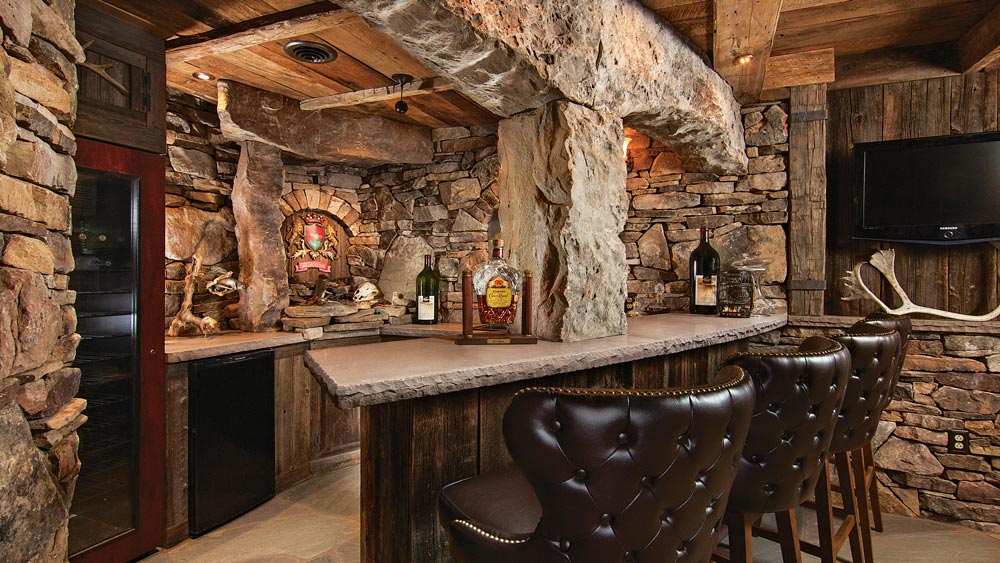
The width and height of the screenshot is (1000, 563). I want to click on whine refrigerator, so click(x=102, y=218).